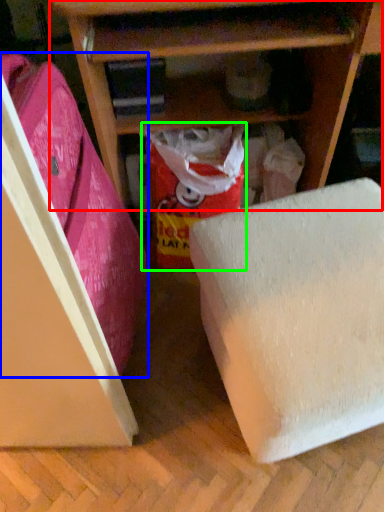
Question: Which is farther away from shelf (highlighted by a red box)? leftover (highlighted by a blue box) or wrapping paper (highlighted by a green box)?

Choices:
 (A) leftover
 (B) wrapping paper

Answer: (A)